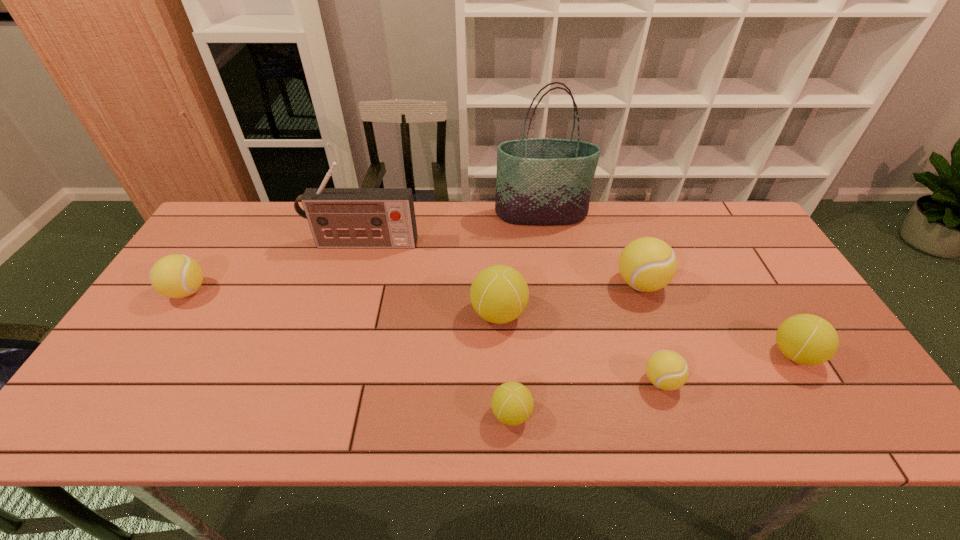
Locate which tennis ball is the fifth closest to the seventh nearest object. Please provide its 2D coordinates. Your answer should be formatted as a tuple, i.e. [(x, y)], where the tuple contains the x and y coordinates of a point satisfying the conditions above.

[(667, 370)]

Locate which tennis ball ranks fourth in proximity to the biggest yellow tennis ball. Please provide its 2D coordinates. Your answer should be formatted as a tuple, i.e. [(x, y)], where the tuple contains the x and y coordinates of a point satisfying the conditions above.

[(512, 403)]

You are a GUI agent. You are given a task and a screenshot of the screen. Output one action in this format:
    pyautogui.click(x=<x>, y=<y>)
    Task: Click on the third closest yellow tennis ball relative to the second farthest object
    
    Given the screenshot: What is the action you would take?
    pyautogui.click(x=667, y=370)

What are the coordinates of `the second closest yellow tennis ball relative to the biggest yellow tennis ball` in the screenshot? It's located at (175, 276).

Where is `green tennis ball that is the nearest to the nearest green tennis ball`? The image size is (960, 540). green tennis ball that is the nearest to the nearest green tennis ball is located at coordinates (499, 294).

Locate an element on the screen. green tennis ball that is the second nearest to the nearest yellow tennis ball is located at coordinates (512, 403).

Find the location of a particular element. The image size is (960, 540). vacant space that satisfies the following two spatial constraints: 1. on the front panel of the second object from left to right; 2. on the left side of the smallest green tennis ball is located at coordinates (313, 414).

You are a GUI agent. You are given a task and a screenshot of the screen. Output one action in this format:
    pyautogui.click(x=<x>, y=<y>)
    Task: Click on the vacant space that satisfies the following two spatial constraints: 1. on the front panel of the biggest green tennis ball; 2. on the right side of the radio receiver
    
    Given the screenshot: What is the action you would take?
    pyautogui.click(x=343, y=313)

Image resolution: width=960 pixels, height=540 pixels. What are the coordinates of `vacant region that satisfies the following two spatial constraints: 1. on the back side of the nearest yellow tennis ball; 2. on the left side of the second biggest green tennis ball` in the screenshot? It's located at (653, 354).

Image resolution: width=960 pixels, height=540 pixels. Find the location of `vacant area that satisfies the following two spatial constraints: 1. on the front panel of the second tallest object; 2. on the right side of the nearest yellow tennis ball`. vacant area that satisfies the following two spatial constraints: 1. on the front panel of the second tallest object; 2. on the right side of the nearest yellow tennis ball is located at coordinates (323, 381).